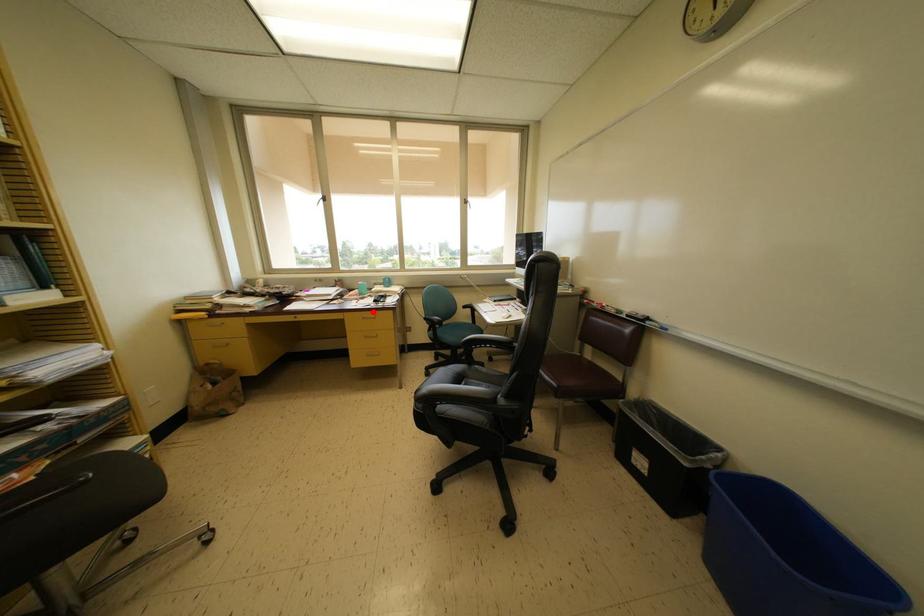
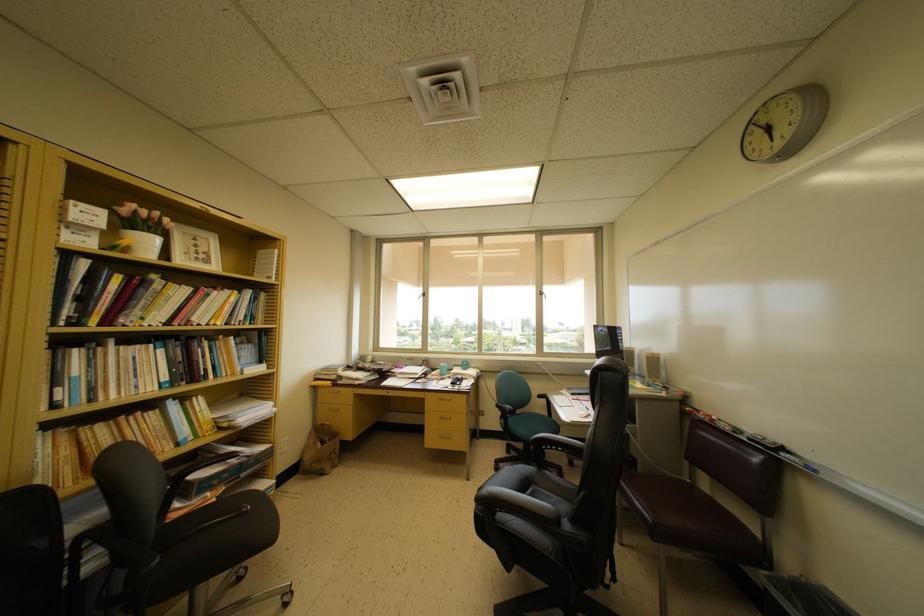
Question: I am providing you with two images of the same scene from different viewpoints. A red point is marked on the first image. Is the red point's position out of view in image 2?

Choices:
 (A) Yes
 (B) No

Answer: (B)